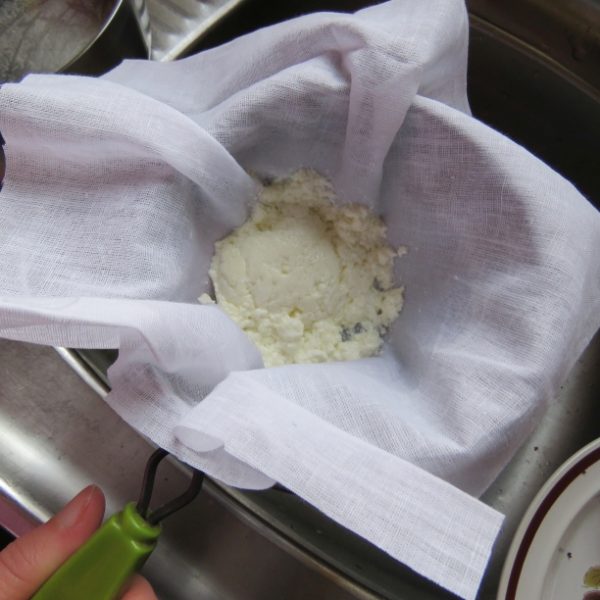
Identify the location of side of metal bowl. (117, 45).